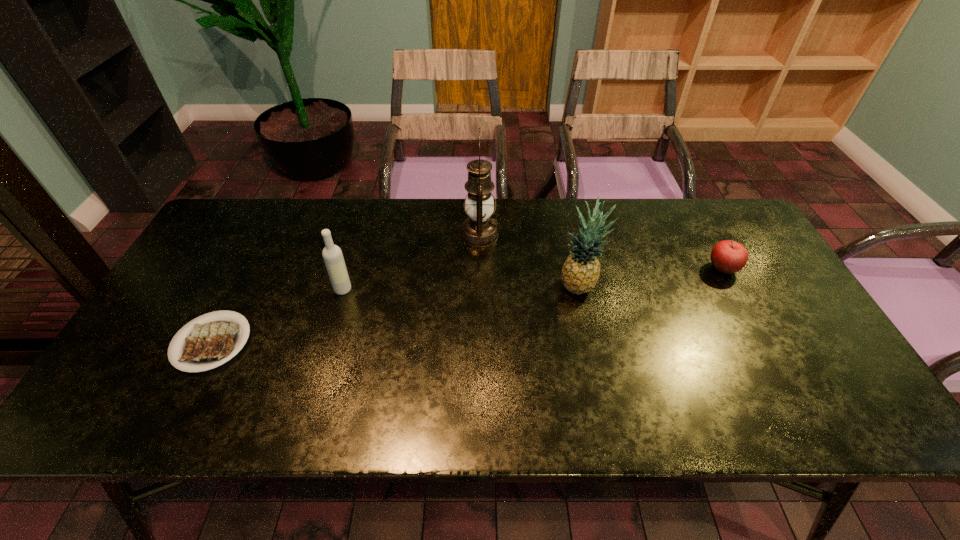
You are a GUI agent. You are given a task and a screenshot of the screen. Output one action in this format:
    pyautogui.click(x=<x>, y=<y>)
    Task: Click on the free point located on the right of the farthest object
    
    Given the screenshot: What is the action you would take?
    pyautogui.click(x=582, y=235)

At what (x,y) coordinates should I click in order to perform the action: click on free region located 0.200m on the front of the fourth object from left to right. Please return your answer as a coordinate pair (x, y). Looking at the image, I should click on (x=595, y=364).

The height and width of the screenshot is (540, 960). I want to click on free space located 0.050m on the left of the vodka, so click(316, 289).

Image resolution: width=960 pixels, height=540 pixels. Identify the location of free spot located on the left of the apple. (571, 268).

Where is `vacant point located on the right of the shortest object`? vacant point located on the right of the shortest object is located at coordinates (389, 343).

Locate an element on the screen. This screenshot has height=540, width=960. object located at the far edge is located at coordinates (479, 230).

Where is `object present at the left edge`? This screenshot has height=540, width=960. object present at the left edge is located at coordinates (211, 343).

Image resolution: width=960 pixels, height=540 pixels. I want to click on object present at the right edge, so click(x=728, y=256).

Find the location of `free space at the far edge of the desktop`. free space at the far edge of the desktop is located at coordinates (660, 210).

This screenshot has width=960, height=540. What are the coordinates of `blank space at the near edge` in the screenshot? It's located at (431, 397).